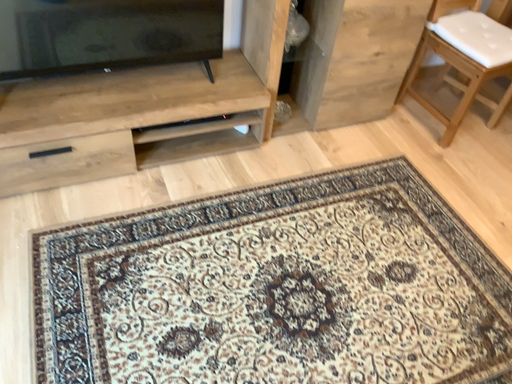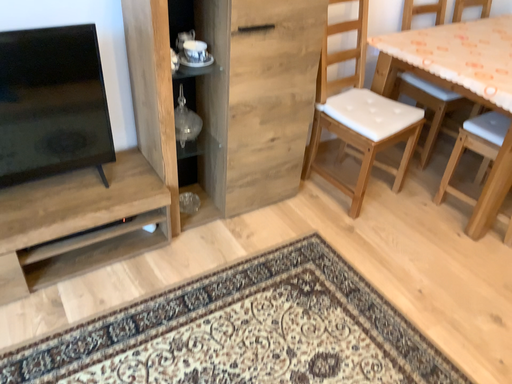
Question: How did the camera likely rotate when shooting the video?

Choices:
 (A) rotated upward
 (B) rotated downward

Answer: (A)